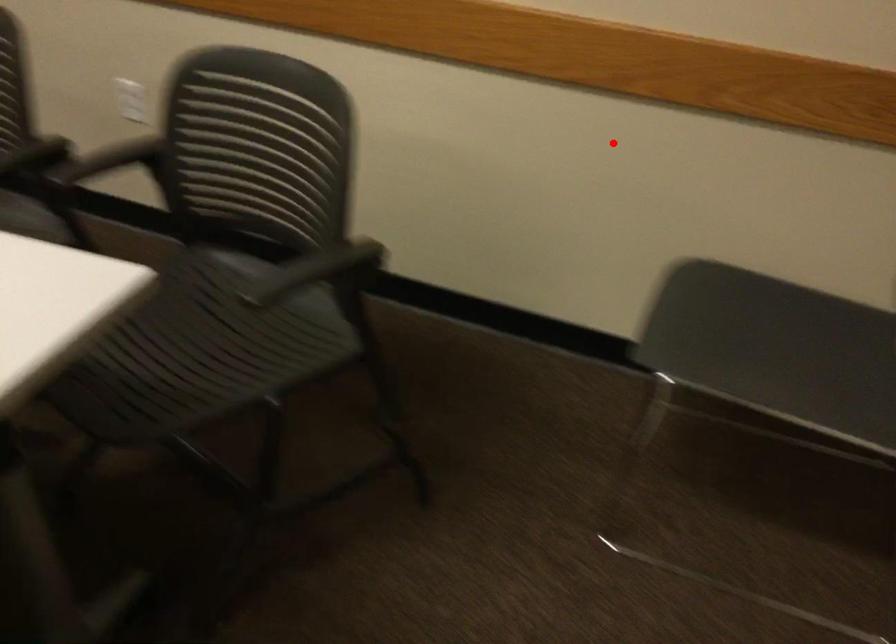
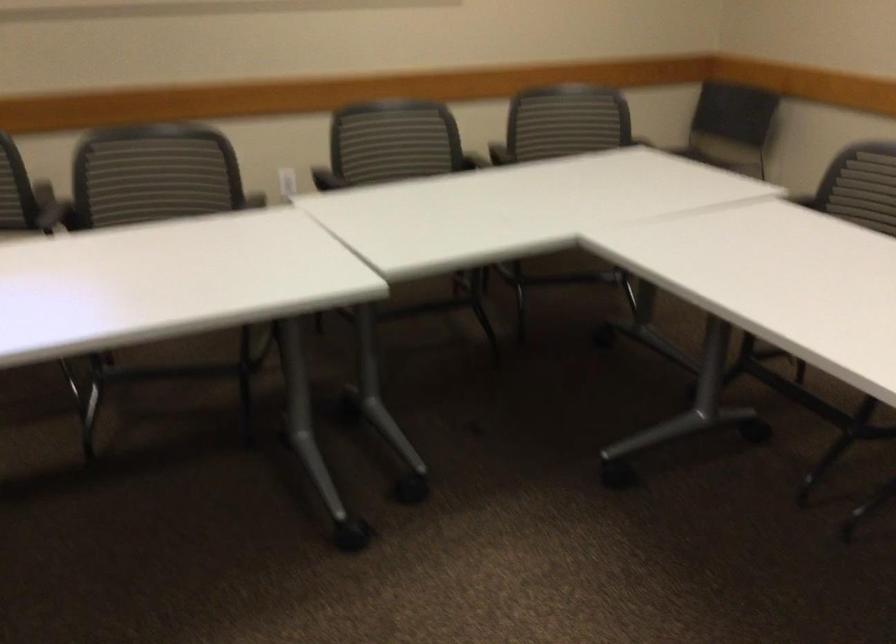
Question: I am providing you with two images of the same scene from different viewpoints. Image1 has a red point marked. In image2, the corresponding 3D location appears at what relative position? Reply with the corresponding letter.

Choices:
 (A) Closer
 (B) Farther

Answer: (B)